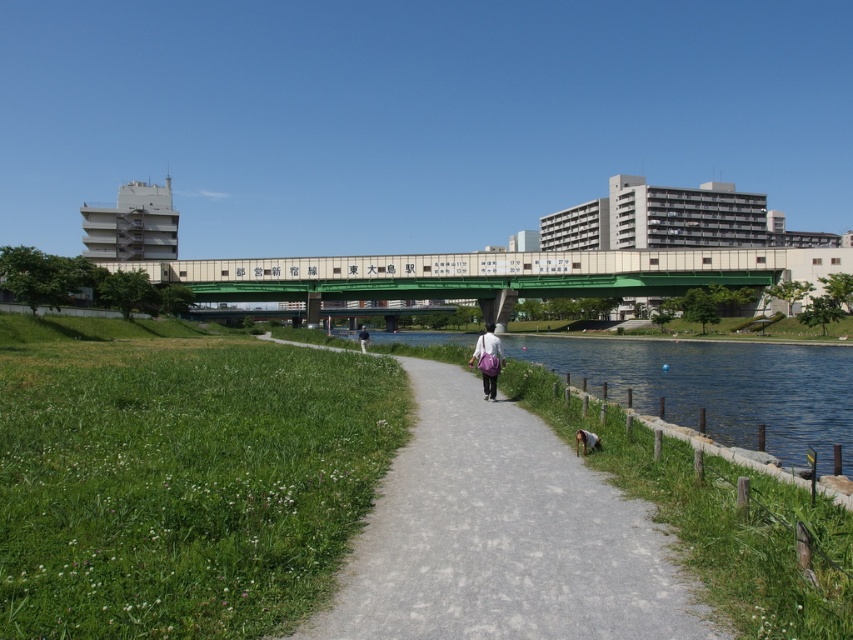
Question: Can you confirm if green grass at lower left is positioned to the left of light blue fabric shirt at center?

Choices:
 (A) no
 (B) yes

Answer: (A)

Question: Which point is closer to the camera?

Choices:
 (A) light blue fabric shirt at center
 (B) gray asphalt path at center
 (C) purple fabric bag at center
 (D) clear blue water at center

Answer: (B)

Question: Based on their relative distances, which object is farther from the green grass at lower left?

Choices:
 (A) purple fabric bag at center
 (B) green metallic bridge at center

Answer: (B)

Question: Where is gray asphalt path at center located in relation to purple fabric bag at center in the image?

Choices:
 (A) below
 (B) above

Answer: (A)

Question: Can you confirm if purple fabric bag at center is positioned to the left of light blue fabric shirt at center?

Choices:
 (A) yes
 (B) no

Answer: (B)

Question: Among these objects, which one is nearest to the camera?

Choices:
 (A) gray asphalt path at center
 (B) green metallic bridge at center
 (C) purple fabric bag at center

Answer: (A)